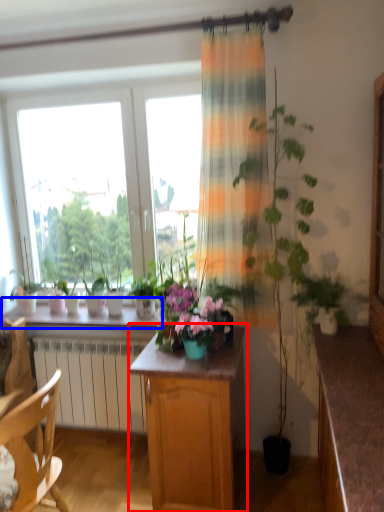
Question: Among these objects, which one is nearest to the camera, cabinetry (highlighted by a red box) or window sill (highlighted by a blue box)?

Choices:
 (A) cabinetry
 (B) window sill

Answer: (A)